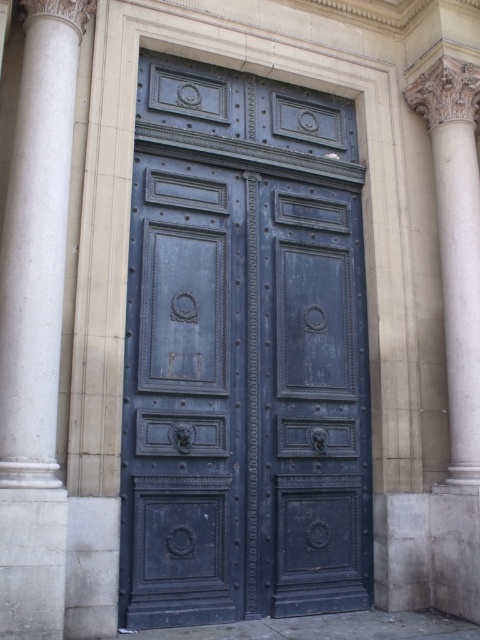
Is dark blue wood door at center taller than white marble column at left?

No, dark blue wood door at center is not taller than white marble column at left.

You are a GUI agent. You are given a task and a screenshot of the screen. Output one action in this format:
    pyautogui.click(x=<x>, y=<y>)
    Task: Click on the dark blue wood door at center
    
    Given the screenshot: What is the action you would take?
    pyautogui.click(x=243, y=385)